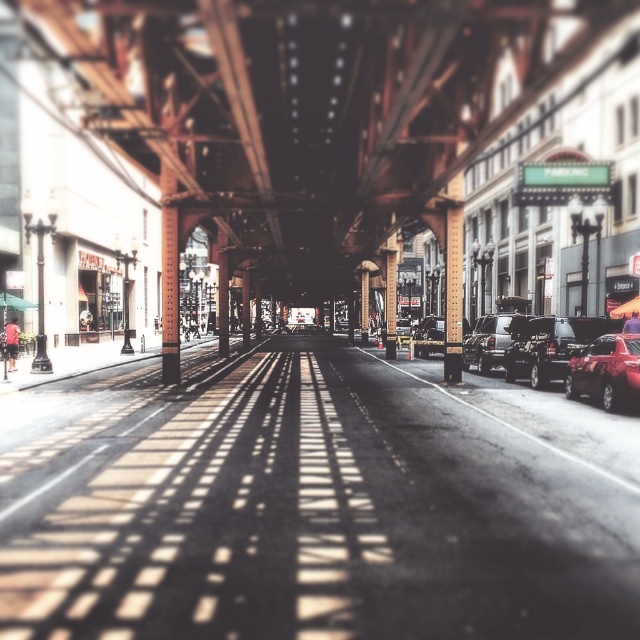
You are standing at the starting point on the street and want to reach a destination located at point (451, 280). There is an obstacle at point (552, 358). Can you walk directly towards your destination without going around the obstacle?

Point (552, 358) is in front of point (451, 280), so the obstacle is blocking the path. You cannot walk directly towards your destination without going around the obstacle.

You are a pedestrian standing on the street looking down the road. You see a shiny red sedan at right and a metallic gray pillar at center. Which object is closer to your right side?

The shiny red sedan at right is closer to your right side because it is positioned to the right of the metallic gray pillar at center.